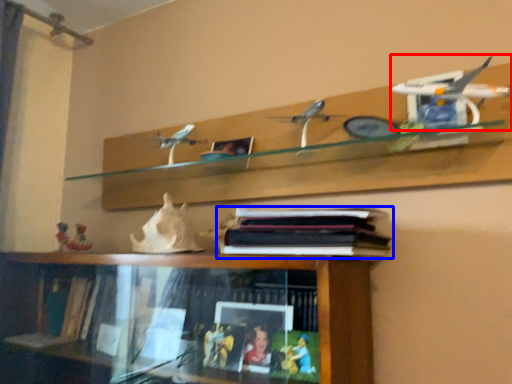
Question: Among these objects, which one is nearest to the camera, aircraft model (highlighted by a red box) or book (highlighted by a blue box)?

Choices:
 (A) aircraft model
 (B) book

Answer: (A)